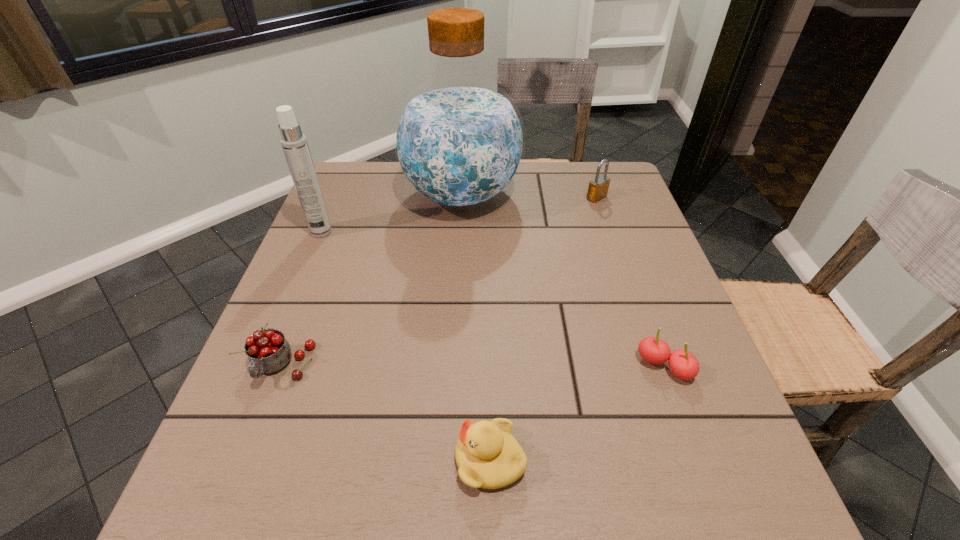
At what (x,y) coordinates should I click in order to perform the action: click on cherry located at the right edge. Please return your answer as a coordinate pair (x, y). Looking at the image, I should click on (683, 364).

What are the coordinates of `object that is positioned at the far right corner` in the screenshot? It's located at (598, 187).

Locate an element on the screen. The width and height of the screenshot is (960, 540). vacant space at the far edge of the desktop is located at coordinates (558, 206).

Identify the location of free location at the near edge. (508, 516).

Where is `vacant region at the left edge of the desktop`? This screenshot has height=540, width=960. vacant region at the left edge of the desktop is located at coordinates (264, 397).

At what (x,y) coordinates should I click in order to perform the action: click on free space at the right edge of the desktop. Please return your answer as a coordinate pair (x, y). The height and width of the screenshot is (540, 960). Looking at the image, I should click on (588, 253).

This screenshot has height=540, width=960. What are the coordinates of `blank space at the far left corner of the desktop` in the screenshot? It's located at (352, 168).

The height and width of the screenshot is (540, 960). In the image, there is a desktop. Identify the location of vacant space at the near left corner. (256, 482).

This screenshot has width=960, height=540. What are the coordinates of `free space at the far right corner of the desktop` in the screenshot? It's located at [627, 180].

Locate an element on the screen. The image size is (960, 540). vacant space that is in between the padlock and the right cherry is located at coordinates (631, 282).